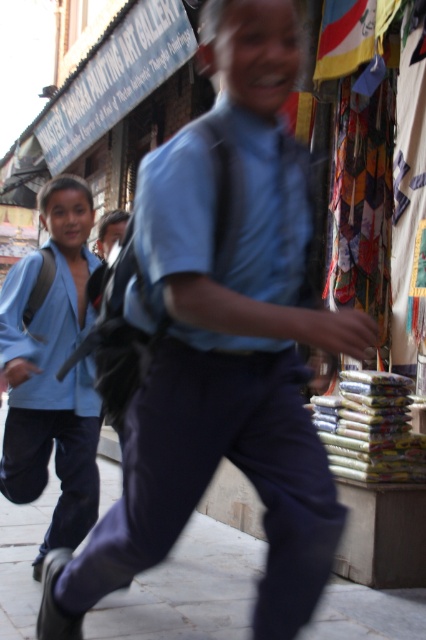
Question: Considering the relative positions of gray concrete pavement at lower center and light blue fabric jacket at left in the image provided, where is gray concrete pavement at lower center located with respect to light blue fabric jacket at left?

Choices:
 (A) right
 (B) left

Answer: (A)

Question: Considering the real-world distances, which object is farthest from the light blue fabric jacket at left?

Choices:
 (A) gray concrete pavement at lower center
 (B) blue cotton shirt at center

Answer: (B)

Question: Where is gray concrete pavement at lower center located in relation to light blue fabric jacket at left in the image?

Choices:
 (A) below
 (B) above

Answer: (A)

Question: Which point is farther to the camera?

Choices:
 (A) (71, 566)
 (B) (42, 188)

Answer: (B)

Question: Is gray concrete pavement at lower center bigger than light blue fabric jacket at left?

Choices:
 (A) yes
 (B) no

Answer: (B)

Question: Which point is farther from the camera taking this photo?

Choices:
 (A) (321, 518)
 (B) (72, 205)

Answer: (B)